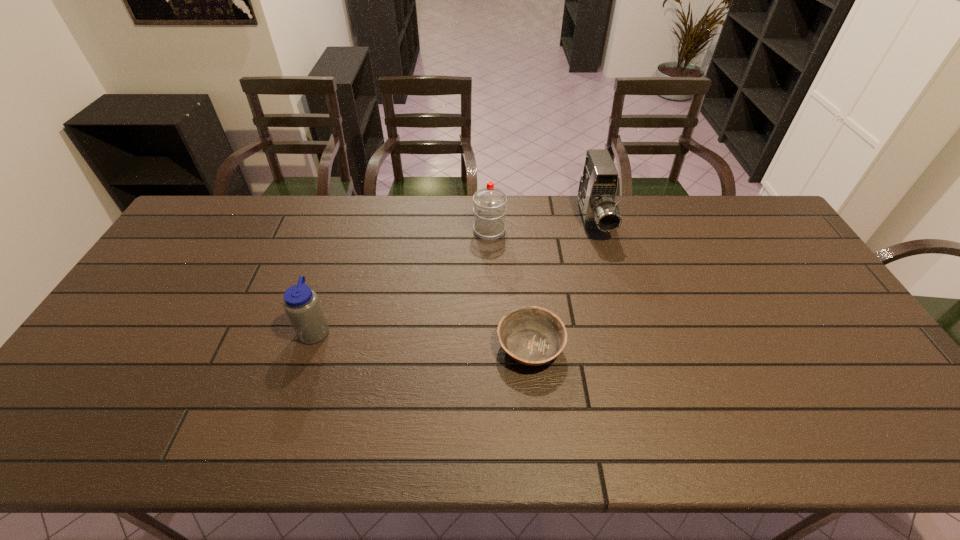
Find the location of a particular element. camcorder is located at coordinates (598, 185).

The width and height of the screenshot is (960, 540). I want to click on the taller water bottle, so click(x=489, y=209).

Find the location of a particular element. Image resolution: width=960 pixels, height=540 pixels. the farther water bottle is located at coordinates (489, 209).

At what (x,y) coordinates should I click in order to perform the action: click on the nearer water bottle. Please return your answer as a coordinate pair (x, y). This screenshot has height=540, width=960. Looking at the image, I should click on (302, 305).

At what (x,y) coordinates should I click in order to perform the action: click on the second shortest object. Please return your answer as a coordinate pair (x, y). Image resolution: width=960 pixels, height=540 pixels. Looking at the image, I should click on (302, 305).

Find the location of a particular element. This screenshot has height=540, width=960. bowl is located at coordinates (534, 336).

Identify the location of vacant space positioned 0.230m at the front of the rightmost object, highlighting the lens. (615, 298).

At what (x,y) coordinates should I click in order to perform the action: click on vacant space located on the handle side of the taller water bottle. Please return your answer as a coordinate pair (x, y). The height and width of the screenshot is (540, 960). Looking at the image, I should click on (489, 212).

Identify the location of free spot located 0.100m on the handle side of the taller water bottle. (489, 203).

Locate an element on the screen. This screenshot has width=960, height=540. vacant space positioned on the handle side of the taller water bottle is located at coordinates (489, 205).